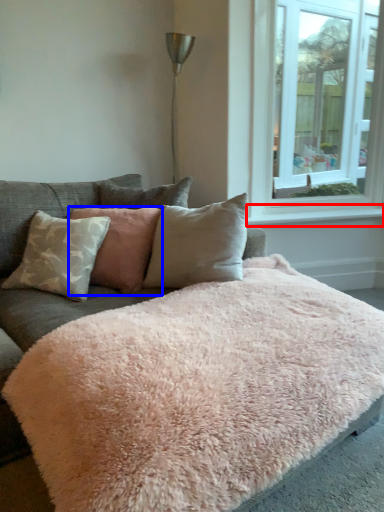
Question: Among these objects, which one is nearest to the camera, window sill (highlighted by a red box) or pillow (highlighted by a blue box)?

Choices:
 (A) window sill
 (B) pillow

Answer: (B)